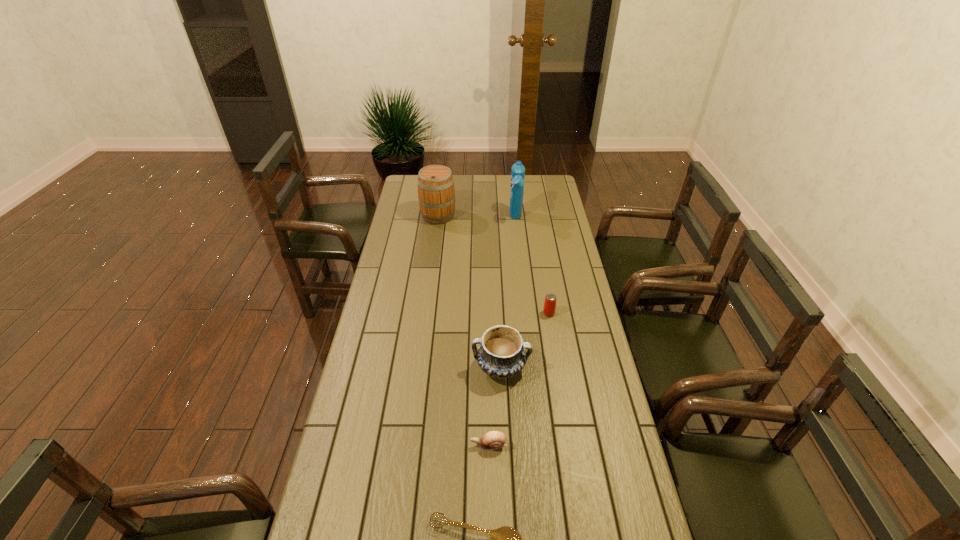
I want to click on free region located 0.170m on the back of the pottery, so click(x=498, y=314).

This screenshot has height=540, width=960. What are the coordinates of `vacant space situated on the left of the beer can` in the screenshot? It's located at (453, 313).

The image size is (960, 540). Find the location of `free region located on the front-facing side of the second shortest object`. free region located on the front-facing side of the second shortest object is located at coordinates (362, 446).

The image size is (960, 540). Find the location of `vacant space located on the front-facing side of the second shortest object`. vacant space located on the front-facing side of the second shortest object is located at coordinates (382, 446).

The height and width of the screenshot is (540, 960). In order to click on free space located 0.190m on the front-facing side of the second shortest object in this screenshot , I will do `click(406, 446)`.

Where is `object at the left edge`? object at the left edge is located at coordinates (436, 193).

You are a GUI agent. You are given a task and a screenshot of the screen. Output one action in this format:
    pyautogui.click(x=<x>, y=<y>)
    Task: Click on the object present at the right edge
    
    Given the screenshot: What is the action you would take?
    pyautogui.click(x=549, y=308)

Find the location of a particular element. This screenshot has height=540, width=960. free space at the far edge is located at coordinates (486, 185).

In the image, there is a desktop. At what (x,y) coordinates should I click in order to perform the action: click on vacant space at the left edge. Please return your answer as a coordinate pair (x, y). Image resolution: width=960 pixels, height=540 pixels. Looking at the image, I should click on 384,464.

Find the location of a particular element. The image size is (960, 540). free space at the right edge of the desktop is located at coordinates (548, 221).